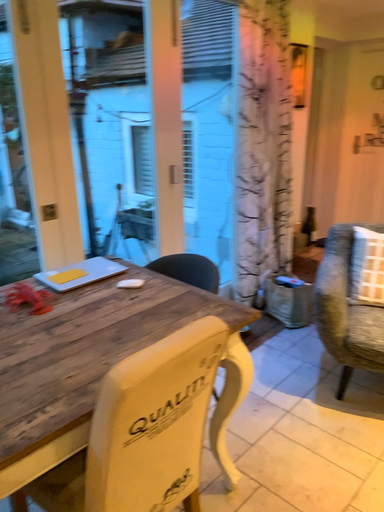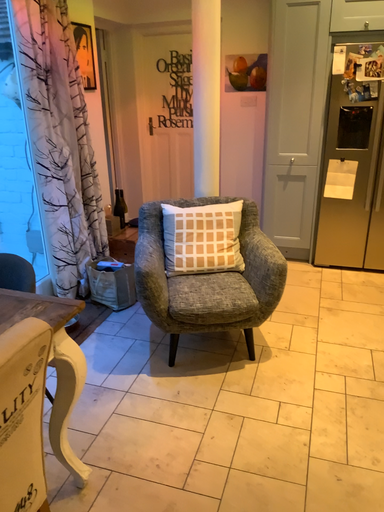
Question: Which way did the camera rotate in the video?

Choices:
 (A) rotated right
 (B) rotated left

Answer: (A)